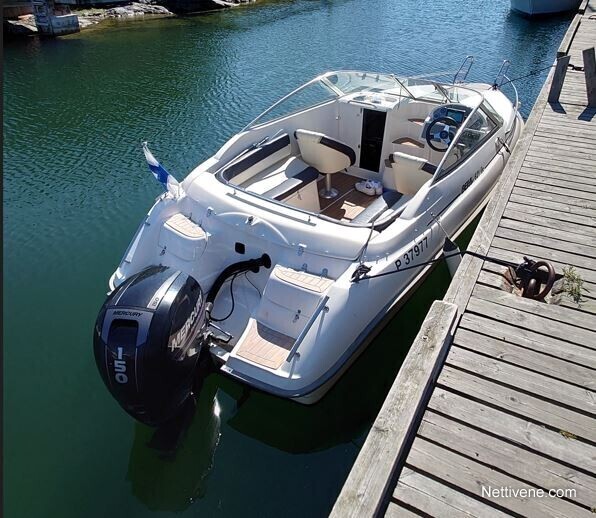
Locate an element on the screen. The image size is (596, 518). transom is located at coordinates (260, 347).